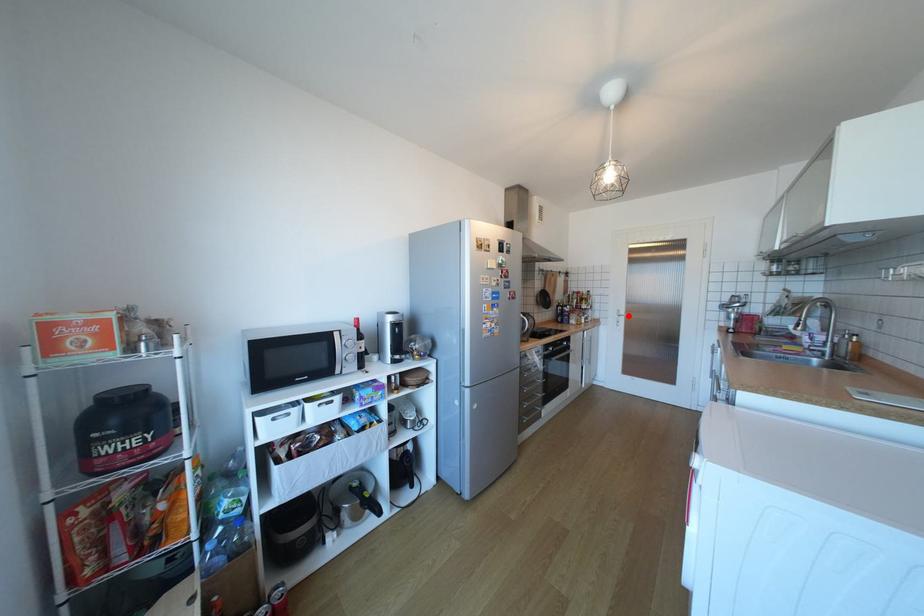
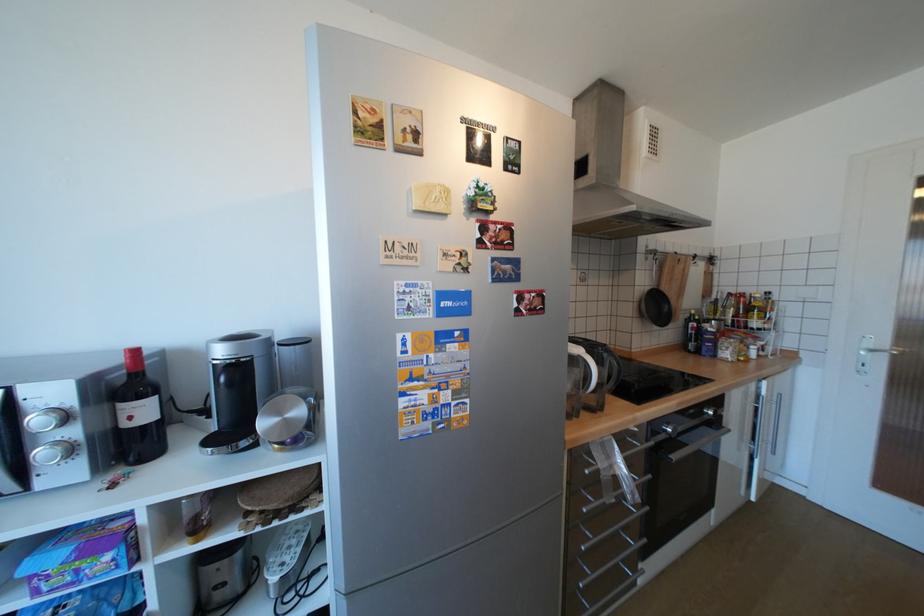
In the second image, find the point that corresponds to the highlighted location in the first image.

(881, 351)